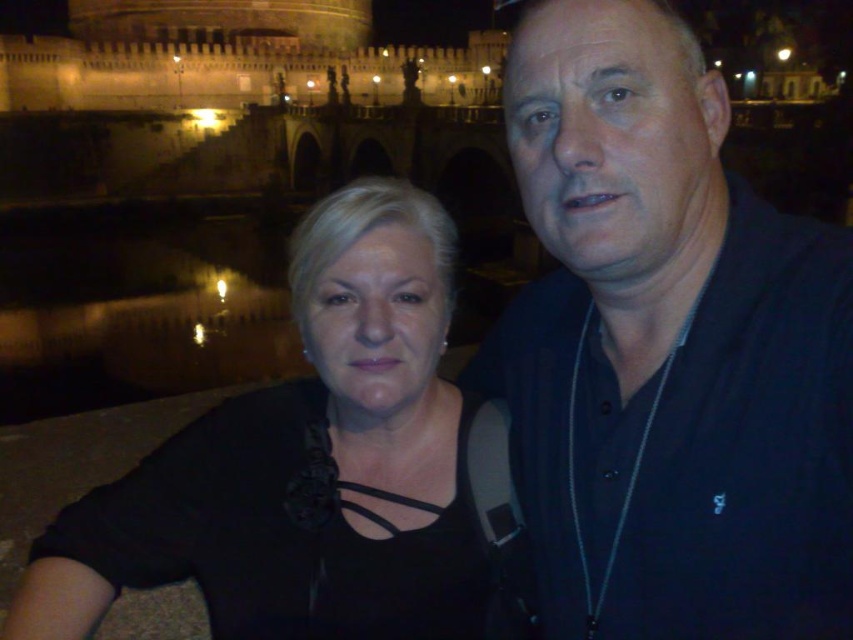
Question: Which point appears farthest from the camera in this image?

Choices:
 (A) (422, 429)
 (B) (724, 458)

Answer: (A)

Question: Does dark blue shirt at center have a smaller size compared to black matte shirt at left?

Choices:
 (A) no
 (B) yes

Answer: (A)

Question: Can you confirm if dark blue shirt at center is smaller than black matte shirt at left?

Choices:
 (A) no
 (B) yes

Answer: (A)

Question: Is dark blue shirt at center below black matte shirt at left?

Choices:
 (A) no
 (B) yes

Answer: (A)

Question: Which object appears closest to the camera in this image?

Choices:
 (A) black matte shirt at left
 (B) dark blue shirt at center

Answer: (B)

Question: Which point is farther from the camera taking this photo?

Choices:
 (A) (709, 604)
 (B) (233, 464)

Answer: (B)